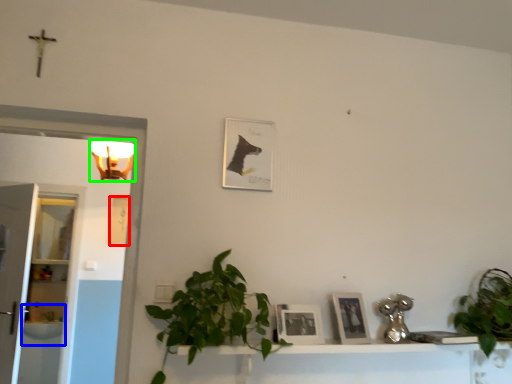
Question: Which object is the closest to the picture frame (highlighted by a red box)? Choose among these: sink (highlighted by a blue box) or light fixture (highlighted by a green box).

Choices:
 (A) sink
 (B) light fixture

Answer: (B)